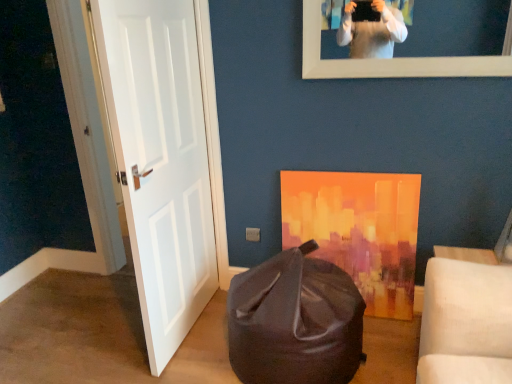
Question: From the image's perspective, is white matte door at left over matte black bean bag at lower center?

Choices:
 (A) no
 (B) yes

Answer: (B)

Question: Does white matte door at left appear on the left side of matte black bean bag at lower center?

Choices:
 (A) no
 (B) yes

Answer: (B)

Question: Is white matte door at left to the right of matte black bean bag at lower center from the viewer's perspective?

Choices:
 (A) yes
 (B) no

Answer: (B)

Question: Is white matte door at left surrounding matte black bean bag at lower center?

Choices:
 (A) yes
 (B) no

Answer: (B)

Question: Is white matte door at left further to the viewer compared to matte black bean bag at lower center?

Choices:
 (A) no
 (B) yes

Answer: (A)

Question: From a real-world perspective, is white matte door at left on top of matte black bean bag at lower center?

Choices:
 (A) no
 (B) yes

Answer: (B)

Question: Could you tell me if white matte door at left is facing white matte picture frame at upper center?

Choices:
 (A) yes
 (B) no

Answer: (B)

Question: Can you confirm if white matte door at left is smaller than white matte picture frame at upper center?

Choices:
 (A) yes
 (B) no

Answer: (B)

Question: Is white matte door at left to the right of white matte picture frame at upper center from the viewer's perspective?

Choices:
 (A) yes
 (B) no

Answer: (B)

Question: Considering the relative sizes of white matte door at left and white matte picture frame at upper center in the image provided, is white matte door at left wider than white matte picture frame at upper center?

Choices:
 (A) no
 (B) yes

Answer: (B)

Question: Can you confirm if white matte door at left is thinner than white matte picture frame at upper center?

Choices:
 (A) yes
 (B) no

Answer: (B)

Question: Is white matte door at left not near white matte picture frame at upper center?

Choices:
 (A) yes
 (B) no

Answer: (B)

Question: Is there a large distance between matte black bean bag at lower center and white matte picture frame at upper center?

Choices:
 (A) no
 (B) yes

Answer: (B)